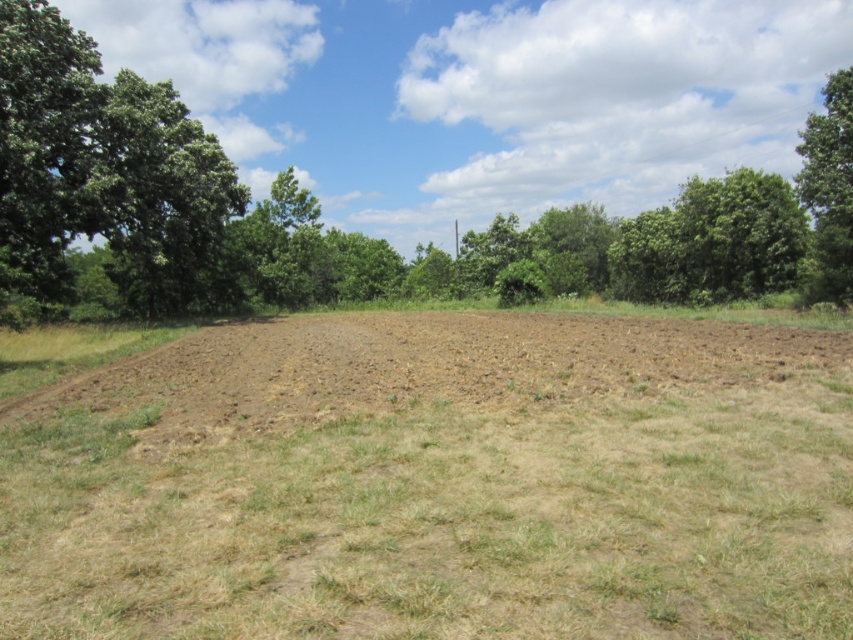
You are a hiker standing in the middle of the field looking towards the forest. Which direction should you walk to reach the green leafy tree at left before the green leafy tree at upper right?

You should walk to the left because the green leafy tree at left is positioned to the left of the green leafy tree at upper right, so it will be encountered first when moving in that direction.

You are a bird looking for a place to perch. You see the green leafy tree at center and the brown soil at center. Which location is higher and better for spotting predators?

The green leafy tree at center is much taller than the brown soil at center, making it the better spot for spotting predators from above.